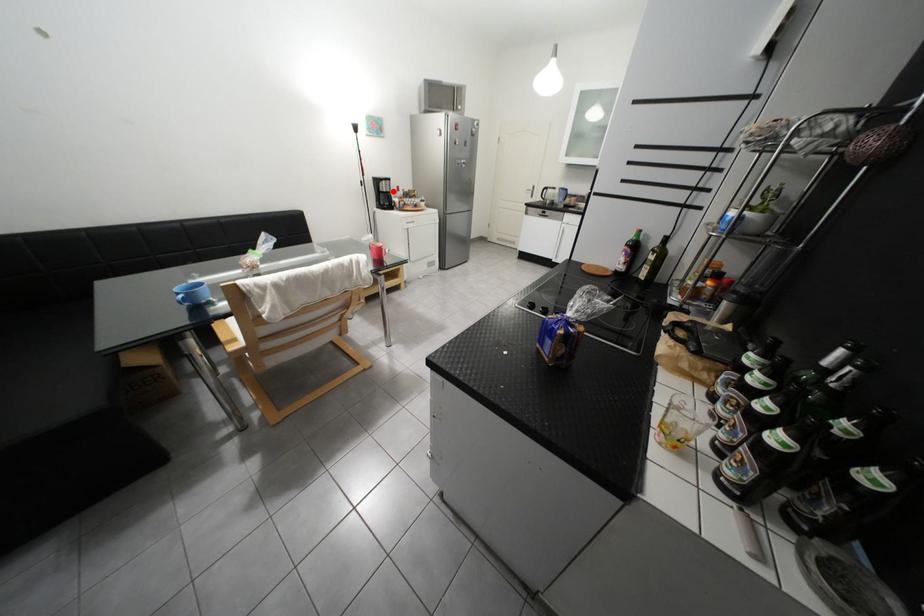
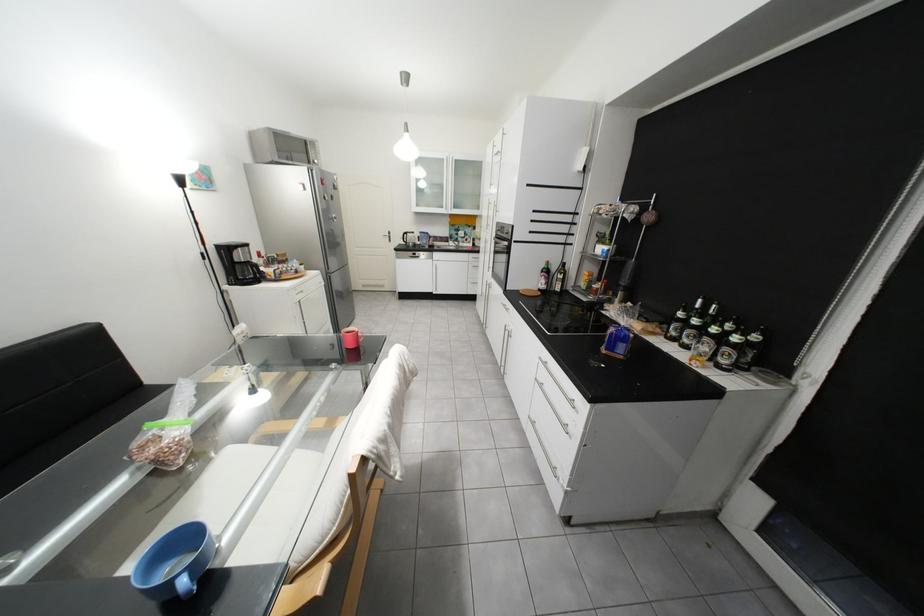
Question: I am providing you with two images of the same scene from different viewpoints. A red point is shown in image1. For the corresponding object point in image2, is it positioned nearer or farther from the camera?

Choices:
 (A) Nearer
 (B) Farther

Answer: (B)